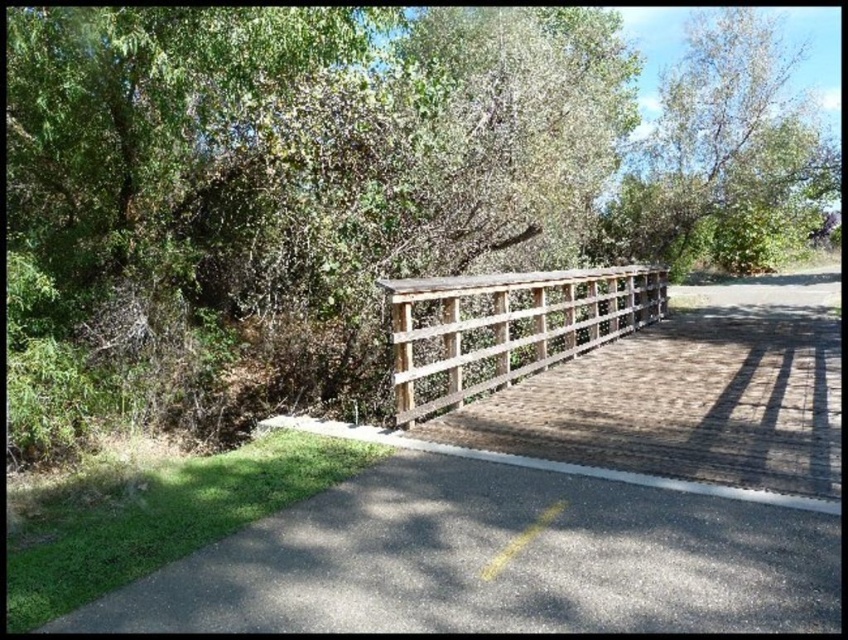
You are an artist planning to paint the scene. You need to decide which object to focus on first based on their sizes. Which object should you paint first, the green leafy tree at upper right or the weathered wood fence at center?

The green leafy tree at upper right has a larger width than the weathered wood fence at center, so you should paint the green leafy tree at upper right first to capture its broader presence in the scene.

You are a park visitor standing on the wooden pedestrian bridge and looking towards the green leafy tree at center and the weathered wood fence at center. Which object is located above the other?

The green leafy tree at center is positioned over the weathered wood fence at center, so the tree is above the fence.